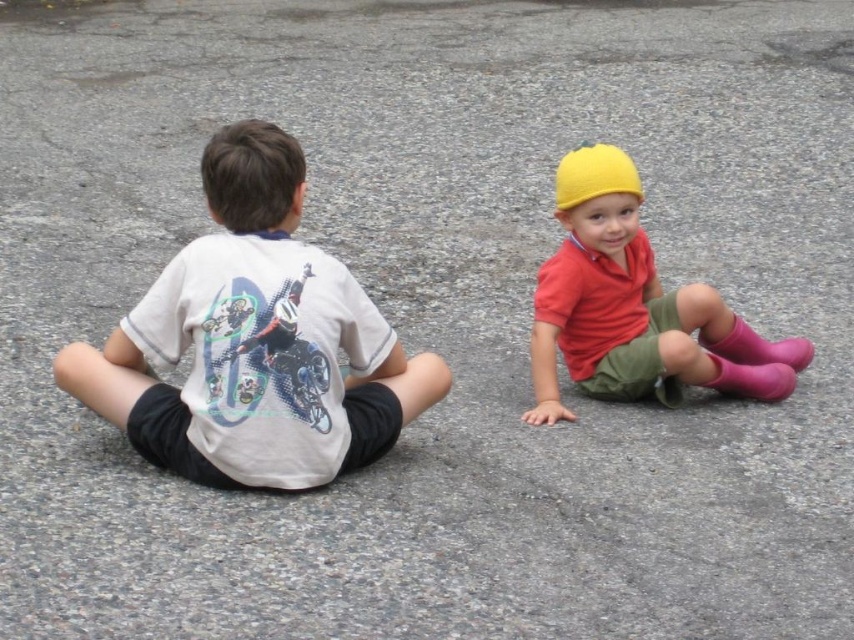
You are a photographer trying to capture a closeup of the yellow knit hat at upper right and the pink rubber boot at lower right. Since you can only focus on one object at a time, which object should you choose to ensure the other is still in the background?

You should focus on the yellow knit hat at upper right because it is closer to the viewer, allowing the pink rubber boot at lower right to remain in the background.

You are standing 10 feet away from the point at coordinates point (188, 314). Can you reach the point without moving closer than 10 feet?

The distance of point (188, 314) from viewer is 12.09 feet, so you are currently 10 feet away and need to move 2.09 feet closer to reach it.

You are a photographer trying to capture both the yellow knit hat at upper right and the pink rubber boot at lower right in a single frame. Since you want to ensure both are clearly visible, which object should you focus on first to account for their sizes?

The yellow knit hat at upper right is larger than the pink rubber boot at lower right, so you should focus on the yellow knit hat at upper right first to ensure its details are sharp before adjusting for the smaller pink rubber boot at lower right.